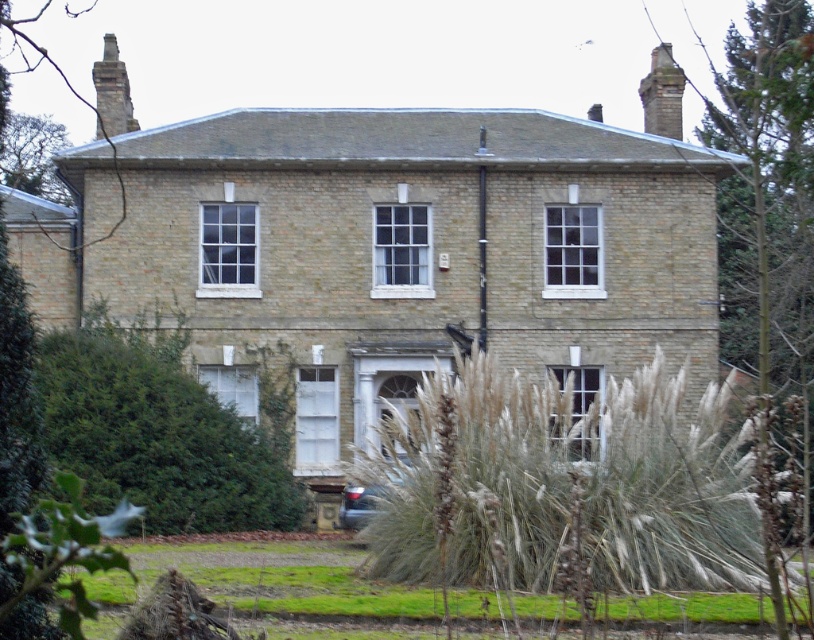
Which is behind, point (99, 72) or point (344, 490)?

The point (99, 72) is behind.

Is point (103, 113) less distant than point (362, 488)?

No, it is behind (362, 488).

The image size is (814, 640). What are the coordinates of `brick chimney at upper left` in the screenshot? It's located at (112, 92).

Is smooth brick chimney at upper right above shiny metallic car at lower center?

Indeed, smooth brick chimney at upper right is positioned over shiny metallic car at lower center.

Find the location of a particular element. smooth brick chimney at upper right is located at coordinates (662, 93).

Who is more forward, (681, 106) or (365, 506)?

Point (365, 506) is in front.

Identify the location of smooth brick chimney at upper right. (662, 93).

Between smooth brick chimney at upper right and brick chimney at upper left, which one has less height?

smooth brick chimney at upper right

Between point (672, 116) and point (101, 68), which one is positioned in front?

Point (101, 68)

Does point (653, 60) lie behind point (117, 132)?

Yes, point (653, 60) is behind point (117, 132).

The image size is (814, 640). I want to click on smooth brick chimney at upper right, so click(x=662, y=93).